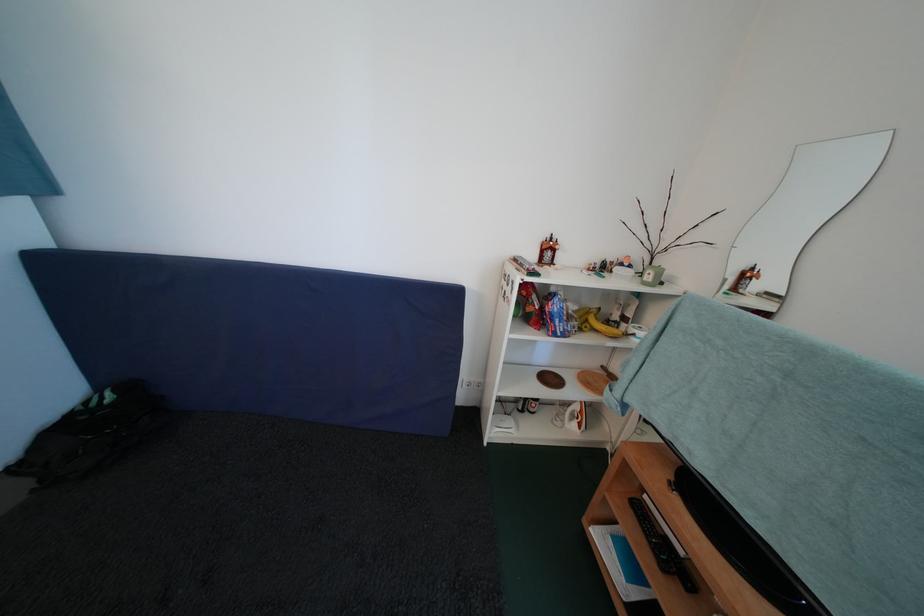
The image size is (924, 616). What do you see at coordinates (798, 214) in the screenshot?
I see `the white iron handle` at bounding box center [798, 214].